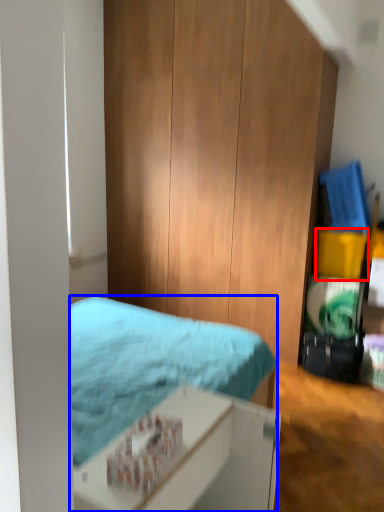
Question: Which of the following is the farthest to the observer, box (highlighted by a red box) or bed (highlighted by a blue box)?

Choices:
 (A) box
 (B) bed

Answer: (A)